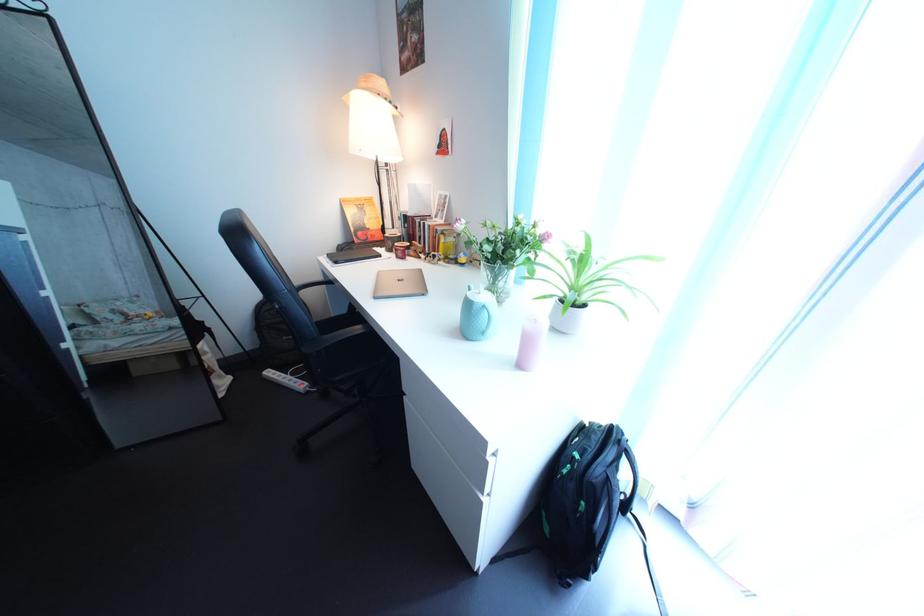
Image resolution: width=924 pixels, height=616 pixels. In order to click on chair armrest in this screenshot , I will do `click(334, 334)`.